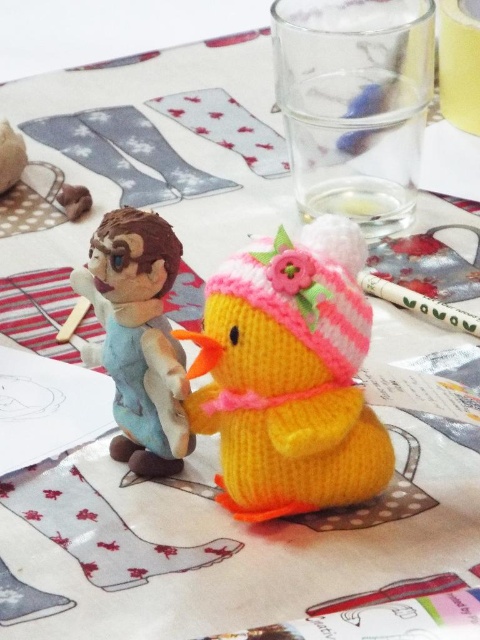
Question: Which of the following is the closest to the observer?

Choices:
 (A) knitted yellow duckling at center
 (B) fuzzy brown monkey at left

Answer: (A)

Question: Is knitted yellow duckling at center below fuzzy brown monkey at left?

Choices:
 (A) yes
 (B) no

Answer: (A)

Question: Where is knitted yellow duckling at center located in relation to fuzzy brown monkey at left in the image?

Choices:
 (A) below
 (B) above

Answer: (A)

Question: Which of the following is the closest to the observer?

Choices:
 (A) knitted yellow duckling at center
 (B) fuzzy brown monkey at left

Answer: (A)

Question: Among these points, which one is nearest to the camera?

Choices:
 (A) pos(143,272)
 (B) pos(241,269)

Answer: (B)

Question: Can you confirm if knitted yellow duckling at center is wider than fuzzy brown monkey at left?

Choices:
 (A) yes
 (B) no

Answer: (A)